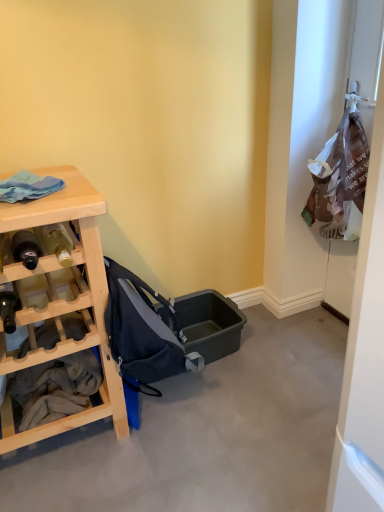
Question: Is matte black bottle at left, the third bottle in the top-to-bottom sequence, positioned with its back to dark blue fabric baby carriage at center?

Choices:
 (A) no
 (B) yes

Answer: (A)

Question: Can you confirm if matte black bottle at left, the 1th bottle ordered from the bottom, is thinner than dark blue fabric baby carriage at center?

Choices:
 (A) no
 (B) yes

Answer: (B)

Question: From the image's perspective, is matte black bottle at left, the third bottle in the top-to-bottom sequence, over dark blue fabric baby carriage at center?

Choices:
 (A) no
 (B) yes

Answer: (B)

Question: Is dark blue fabric baby carriage at center located within matte black bottle at left, the third bottle in the top-to-bottom sequence?

Choices:
 (A) yes
 (B) no

Answer: (B)

Question: Can you confirm if matte black bottle at left, the 1th bottle ordered from the bottom, is positioned to the left of dark blue fabric baby carriage at center?

Choices:
 (A) yes
 (B) no

Answer: (A)

Question: Is matte black bottle at left, the third bottle in the top-to-bottom sequence, facing towards dark blue fabric baby carriage at center?

Choices:
 (A) yes
 (B) no

Answer: (B)

Question: Does matte glass bottle at left, which ranks as the first bottle in top-to-bottom order, lie behind matte black bottle at left, which is the second bottle in bottom-to-top order?

Choices:
 (A) no
 (B) yes

Answer: (B)

Question: Is matte glass bottle at left, which ranks as the first bottle in top-to-bottom order, positioned with its back to matte black bottle at left, which ranks as the 2th bottle in top-to-bottom order?

Choices:
 (A) yes
 (B) no

Answer: (B)

Question: Is matte glass bottle at left, which ranks as the first bottle in top-to-bottom order, facing towards matte black bottle at left, which ranks as the 2th bottle in top-to-bottom order?

Choices:
 (A) no
 (B) yes

Answer: (A)

Question: Does matte glass bottle at left, marked as the third bottle in a bottom-to-top arrangement, have a lesser height compared to matte black bottle at left, which ranks as the 2th bottle in top-to-bottom order?

Choices:
 (A) yes
 (B) no

Answer: (B)

Question: Is matte glass bottle at left, which ranks as the first bottle in top-to-bottom order, at the left side of matte black bottle at left, which is the second bottle in bottom-to-top order?

Choices:
 (A) no
 (B) yes

Answer: (A)

Question: Is matte glass bottle at left, marked as the third bottle in a bottom-to-top arrangement, taller than matte black bottle at left, which ranks as the 2th bottle in top-to-bottom order?

Choices:
 (A) no
 (B) yes

Answer: (B)

Question: Is matte black bottle at left, which ranks as the 2th bottle in top-to-bottom order, oriented away from matte glass bottle at left, marked as the third bottle in a bottom-to-top arrangement?

Choices:
 (A) yes
 (B) no

Answer: (B)